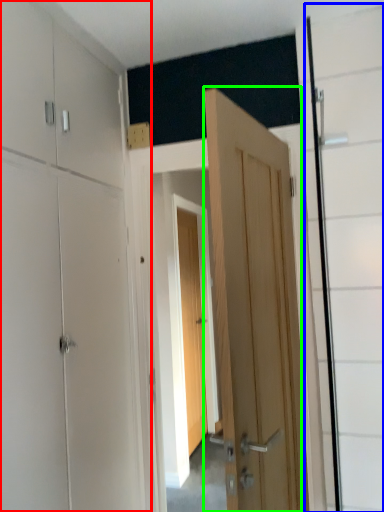
Question: Considering the real-world distances, which object is closest to dresser (highlighted by a red box)? glass door (highlighted by a blue box) or door (highlighted by a green box).

Choices:
 (A) glass door
 (B) door

Answer: (B)